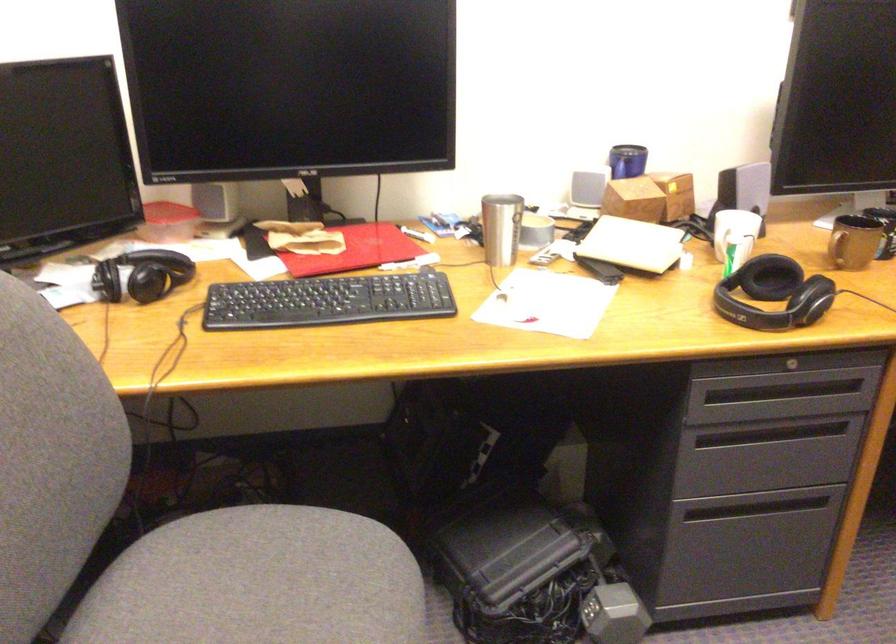
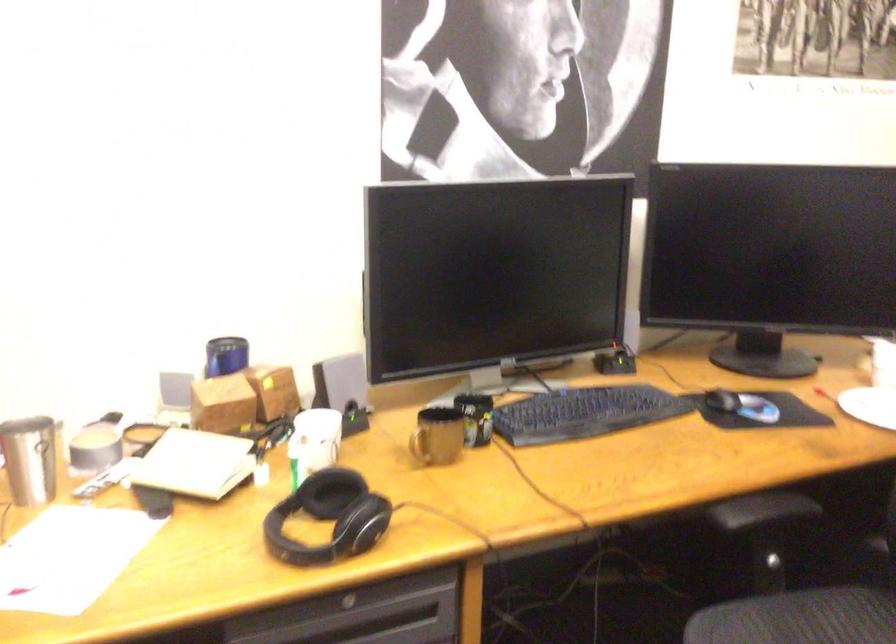
In the second image, find the point that corresponds to the point at 506,220 in the first image.

(30, 459)